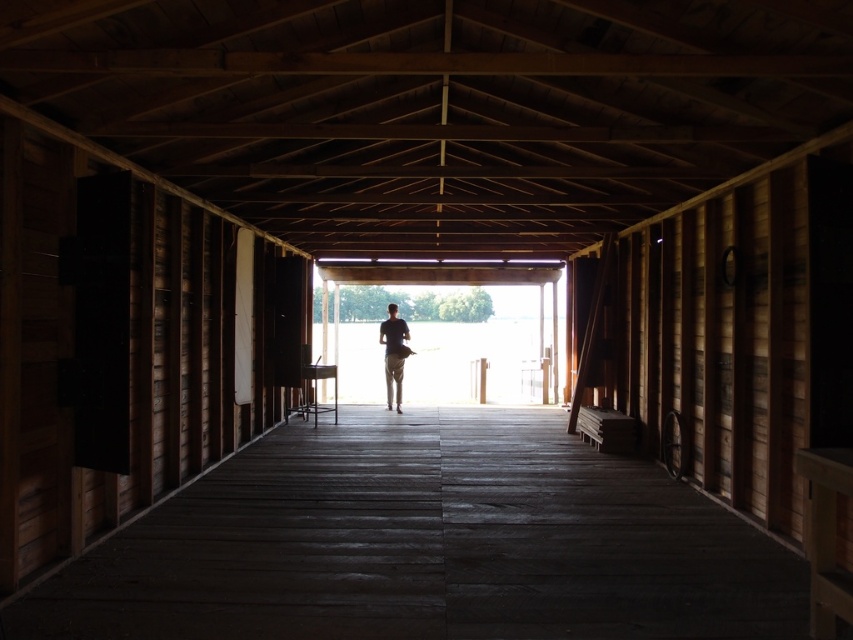
You are standing inside the wooden structure and looking towards the far end. You notice two objects at the center of your view. One is the dark wood floor at center and the other is the dark gray fabric shirt at center. Which one appears closer to you?

The dark wood floor at center appears closer because it has a lesser height compared to the dark gray fabric shirt at center, meaning it is positioned lower in the visual field and thus closer to the observer.

You are standing inside the wooden structure and looking towards the far end. You see the dark wood floor at center and the dark gray fabric shirt at center. Which object is nearer to you?

The dark wood floor at center is closer to the viewer than the dark gray fabric shirt at center.